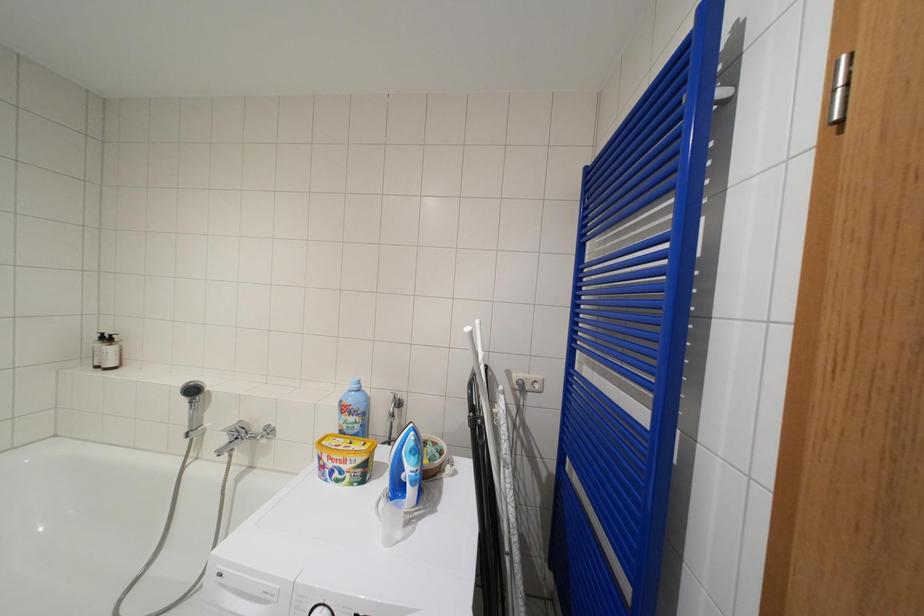
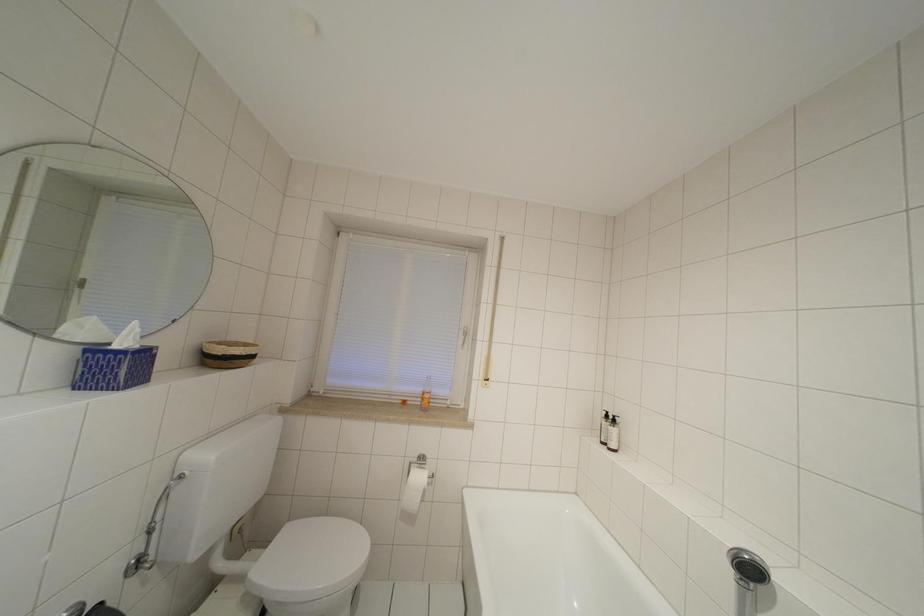
Question: The first image is from the beginning of the video and the second image is from the end. How did the camera likely rotate when shooting the video?

Choices:
 (A) Left
 (B) Right
 (C) Up
 (D) Down

Answer: (A)